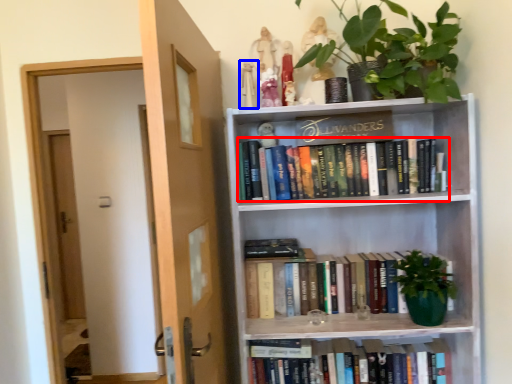
Question: Which of the following is the closest to the observer, book (highlighted by a red box) or toy (highlighted by a blue box)?

Choices:
 (A) book
 (B) toy

Answer: (B)